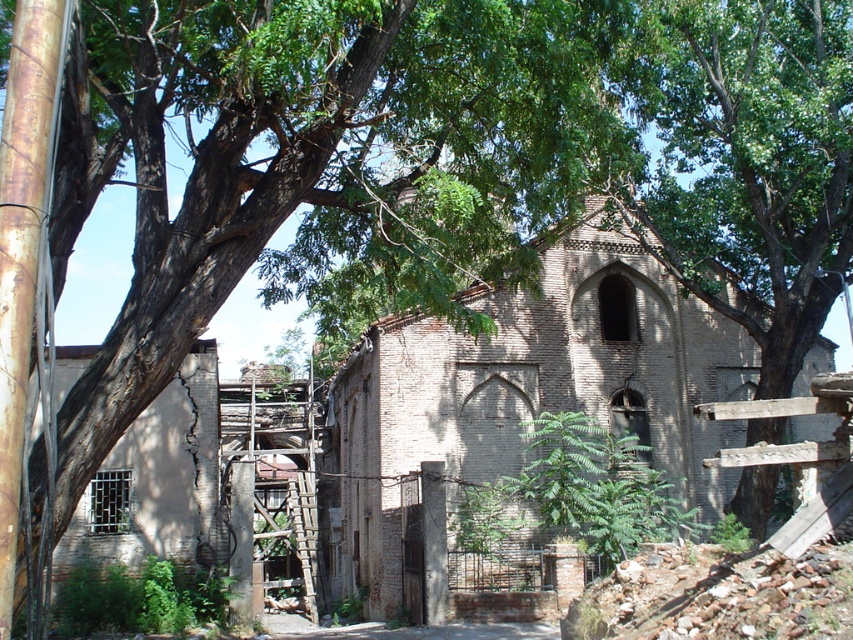
Is brown brick church at center shorter than rusty wooden ladder at center?

In fact, brown brick church at center may be taller than rusty wooden ladder at center.

Between point (627, 317) and point (303, 481), which one is positioned behind?

Point (303, 481)

Is point (386, 481) behind point (296, 490)?

No, (386, 481) is in front of (296, 490).

This screenshot has width=853, height=640. What are the coordinates of `brown brick church at center` in the screenshot? It's located at (521, 400).

Which is above, brown brick church at center or green leafy tree at center?

green leafy tree at center

Is brown brick church at center thinner than green leafy tree at center?

No, brown brick church at center is not thinner than green leafy tree at center.

Is point (473, 371) farther from viewer compared to point (728, 60)?

Yes, it is.

The image size is (853, 640). Find the location of `brown brick church at center`. brown brick church at center is located at coordinates (521, 400).

Looking at this image, between green leafy tree at center and rusty wooden ladder at center, which one is positioned higher?

Positioned higher is green leafy tree at center.

Who is positioned more to the right, green leafy tree at center or rusty wooden ladder at center?

Positioned to the right is green leafy tree at center.

Find the location of a particular element. green leafy tree at center is located at coordinates (749, 164).

The width and height of the screenshot is (853, 640). Identify the location of green leafy tree at center. (749, 164).